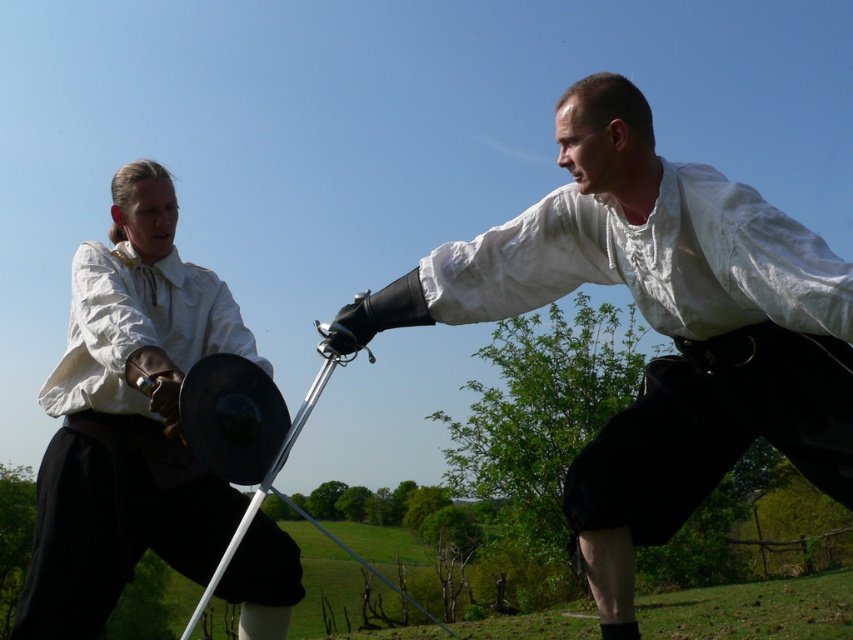
You are standing in the middle of the field and see the point at coordinates point (660, 326). Which object from the scene does this point belong to?

The point (660, 326) is on the white matte shirt at upper right.

You are a costume designer preparing for a historical play. You need to ensure that the white matte shirt at upper right and the black metal pole at center are visible to the audience. Based on their sizes, which one is more likely to block the other from view if placed in front?

The white matte shirt at upper right might be wider than black metal pole at center, so if placed in front, it could potentially block the view of the black metal pole at center more significantly than the other way around.

You are a photographer standing in the middle of the field. You want to take a photo that includes both point (x=531, y=252) and point (x=241, y=451). Which point is closer to your camera?

Point (x=241, y=451) is closer to the camera than point (x=531, y=252).